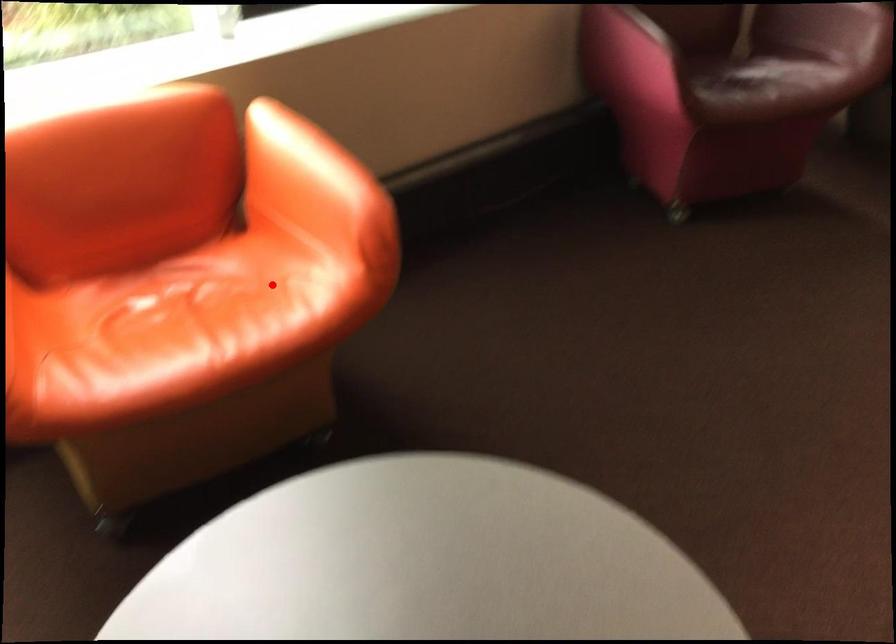
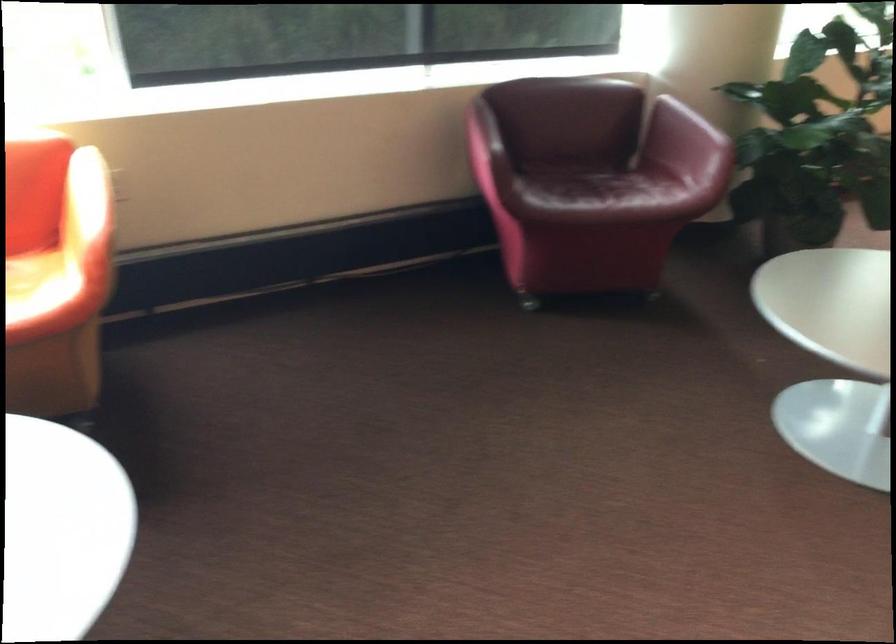
Question: I am providing you with two images of the same scene from different viewpoints. A red point is shown in image1. For the corresponding object point in image2, is it positioned nearer or farther from the camera?

Choices:
 (A) Nearer
 (B) Farther

Answer: (B)